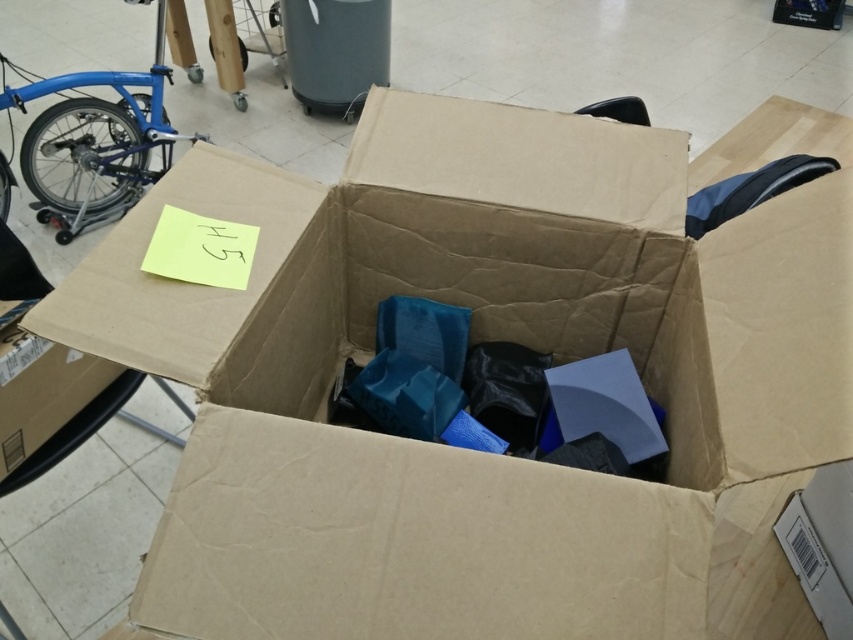
You are trying to fit the matte blue bicycle at left and the brown cardboard box at lower left into a storage unit. Based on their heights, which one will require more vertical space?

The matte blue bicycle at left is taller than the brown cardboard box at lower left, so it will require more vertical space.

You are standing in a storage room and want to move from the entrance to the brown cardboard box at lower left. There is a matte blue bicycle at left blocking your path. Can you walk around it to reach the box?

The matte blue bicycle at left is further to the viewer than the brown cardboard box at lower left, so you can walk around the matte blue bicycle at left to reach the brown cardboard box at lower left.

Looking at this image, you are standing in a storage area and see the matte blue bicycle at left. You need to reach a tool hanging 2.5 meters away from your current position. Can you stretch your arm to grab it from where you are standing?

The matte blue bicycle at left is 2.26 meters from viewer, so if the tool is 2.5 meters away, you are 0.24 meters too far to reach it without moving closer.